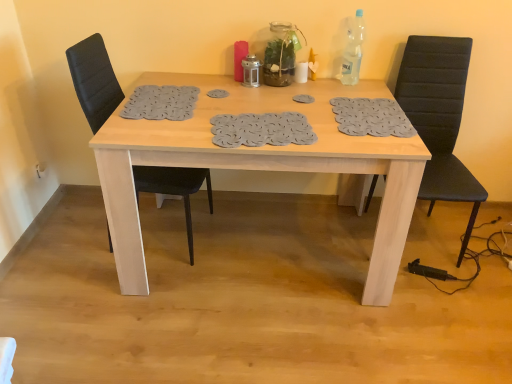
Where is `black leather chair at left, the second chair from the right`? Image resolution: width=512 pixels, height=384 pixels. black leather chair at left, the second chair from the right is located at coordinates (94, 80).

From a real-world perspective, is black leather chair at right, arranged as the 2th chair when viewed from the left, located higher than light wood table at center?

Yes, from a real-world perspective, black leather chair at right, arranged as the 2th chair when viewed from the left, is over light wood table at center

Considering the relative positions of black leather chair at right, arranged as the 2th chair when viewed from the left, and light wood table at center in the image provided, is black leather chair at right, arranged as the 2th chair when viewed from the left, behind light wood table at center?

Yes, black leather chair at right, arranged as the 2th chair when viewed from the left, is further from the viewer.

Can you confirm if black leather chair at right, arranged as the 2th chair when viewed from the left, is wider than light wood table at center?

No, black leather chair at right, arranged as the 2th chair when viewed from the left, is not wider than light wood table at center.

Looking at this image, looking at their sizes, would you say light wood table at center is wider or thinner than black leather chair at left, the second chair from the right?

light wood table at center is wider than black leather chair at left, the second chair from the right.

Is point (385, 194) farther from viewer compared to point (88, 98)?

No, it is in front of (88, 98).

From the image's perspective, between light wood table at center and black leather chair at left, positioned as the 1th chair in left-to-right order, who is located below?

light wood table at center is shown below in the image.

Is light wood table at center in front of or behind black leather chair at left, positioned as the 1th chair in left-to-right order, in the image?

Clearly, light wood table at center is in front of black leather chair at left, positioned as the 1th chair in left-to-right order.

Is light wood table at center in front of or behind black leather chair at right, which is counted as the first chair, starting from the right, in the image?

In the image, light wood table at center appears in front of black leather chair at right, which is counted as the first chair, starting from the right.

Which object is thinner, light wood table at center or black leather chair at right, which is counted as the first chair, starting from the right?

black leather chair at right, which is counted as the first chair, starting from the right.

In terms of height, does light wood table at center look taller or shorter compared to black leather chair at right, which is counted as the first chair, starting from the right?

In the image, light wood table at center appears to be shorter than black leather chair at right, which is counted as the first chair, starting from the right.

Which of these two, black leather chair at left, positioned as the 1th chair in left-to-right order, or black leather chair at right, arranged as the 2th chair when viewed from the left, is smaller?

black leather chair at left, positioned as the 1th chair in left-to-right order.

From a real-world perspective, between black leather chair at left, the second chair from the right, and black leather chair at right, which is counted as the first chair, starting from the right, who is vertically lower?

black leather chair at right, which is counted as the first chair, starting from the right.

Locate an element on the screen. chair below the black leather chair at left, the second chair from the right (from a real-world perspective) is located at coordinates (439, 118).

Considering the relative sizes of black leather chair at left, positioned as the 1th chair in left-to-right order, and light wood table at center in the image provided, is black leather chair at left, positioned as the 1th chair in left-to-right order, thinner than light wood table at center?

Indeed, black leather chair at left, positioned as the 1th chair in left-to-right order, has a lesser width compared to light wood table at center.

Based on their positions, is black leather chair at left, the second chair from the right, located to the left or right of light wood table at center?

In the image, black leather chair at left, the second chair from the right, appears on the left side of light wood table at center.

Is point (192, 247) farther from camera compared to point (310, 169)?

That is True.

From the image's perspective, which object appears higher, black leather chair at right, arranged as the 2th chair when viewed from the left, or black leather chair at left, positioned as the 1th chair in left-to-right order?

black leather chair at left, positioned as the 1th chair in left-to-right order.

Based on the photo, is the surface of black leather chair at right, arranged as the 2th chair when viewed from the left, in direct contact with black leather chair at left, positioned as the 1th chair in left-to-right order?

No, black leather chair at right, arranged as the 2th chair when viewed from the left, is not beside black leather chair at left, positioned as the 1th chair in left-to-right order.

Who is bigger, black leather chair at right, which is counted as the first chair, starting from the right, or black leather chair at left, the second chair from the right?

Bigger between the two is black leather chair at right, which is counted as the first chair, starting from the right.

This screenshot has height=384, width=512. What are the coordinates of `chair that is the 2nd object located behind the light wood table at center` in the screenshot? It's located at (439, 118).

At what (x,y) coordinates should I click in order to perform the action: click on table that appears in front of the black leather chair at left, the second chair from the right. Please return your answer as a coordinate pair (x, y). This screenshot has width=512, height=384. Looking at the image, I should click on (257, 164).

Considering their positions, is light wood table at center positioned closer to black leather chair at left, positioned as the 1th chair in left-to-right order, than black leather chair at right, arranged as the 2th chair when viewed from the left?

Among the two, light wood table at center is located nearer to black leather chair at left, positioned as the 1th chair in left-to-right order.

From the image, which object appears to be farther from light wood table at center, black leather chair at left, positioned as the 1th chair in left-to-right order, or black leather chair at right, arranged as the 2th chair when viewed from the left?

black leather chair at right, arranged as the 2th chair when viewed from the left, lies further to light wood table at center than the other object.

When comparing their distances from light wood table at center, does black leather chair at right, which is counted as the first chair, starting from the right, or black leather chair at left, the second chair from the right, seem closer?

→ black leather chair at left, the second chair from the right, is closer to light wood table at center.

Looking at the image, which one is located closer to black leather chair at right, arranged as the 2th chair when viewed from the left, light wood table at center or black leather chair at left, the second chair from the right?

light wood table at center is positioned closer to the anchor black leather chair at right, arranged as the 2th chair when viewed from the left.

Which object lies nearer to the anchor point black leather chair at right, which is counted as the first chair, starting from the right, black leather chair at left, positioned as the 1th chair in left-to-right order, or light wood table at center?

Based on the image, light wood table at center appears to be nearer to black leather chair at right, which is counted as the first chair, starting from the right.

Consider the image. From the image, which object appears to be nearer to black leather chair at left, the second chair from the right, black leather chair at right, which is counted as the first chair, starting from the right, or light wood table at center?

light wood table at center lies closer to black leather chair at left, the second chair from the right, than the other object.

This screenshot has width=512, height=384. What are the coordinates of `table between black leather chair at left, the second chair from the right, and black leather chair at right, arranged as the 2th chair when viewed from the left` in the screenshot? It's located at (257, 164).